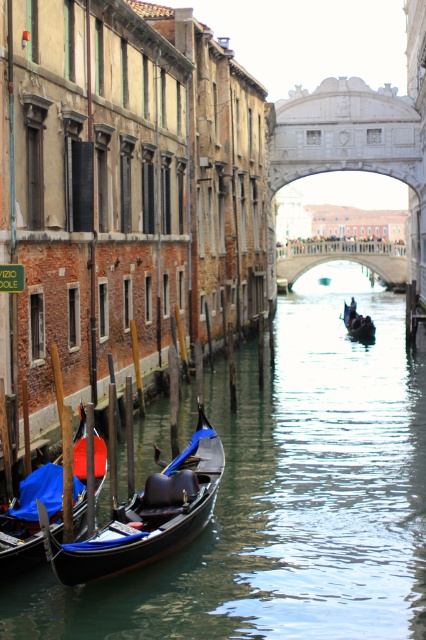
You are a tourist standing on the bridge overlooking the canal. You want to take a photo of the shiny black gondola at center without any reflections from the clear water at canal center. Is the gondola visible above the water?

The clear water at canal center is taller than the shiny black gondola at center, meaning the water is deeper there. However, gondolas are designed to float with most of their structure above water. Since the question is about visibility, the gondola would still be visible above the water despite the depth, so yes, you can take the photo as desired.

You are a tourist standing on the bridge overlooking the canal. You see the shiny black gondola at center and the blue velvet gondola at lower left. Which gondola is closer to you?

The shiny black gondola at center is closer to you because it is in front of the blue velvet gondola at lower left.